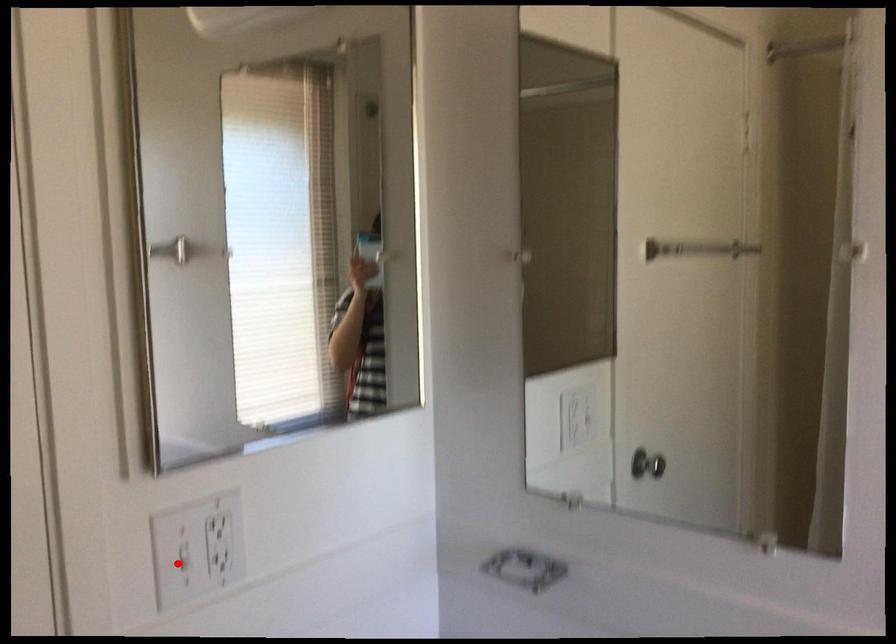
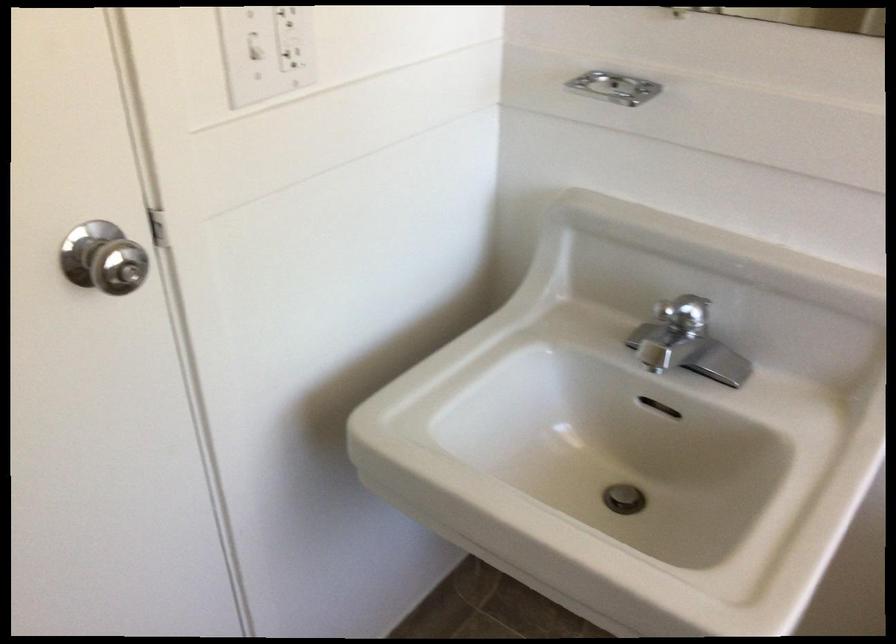
In the second image, find the point that corresponds to the highlighted location in the first image.

(254, 46)